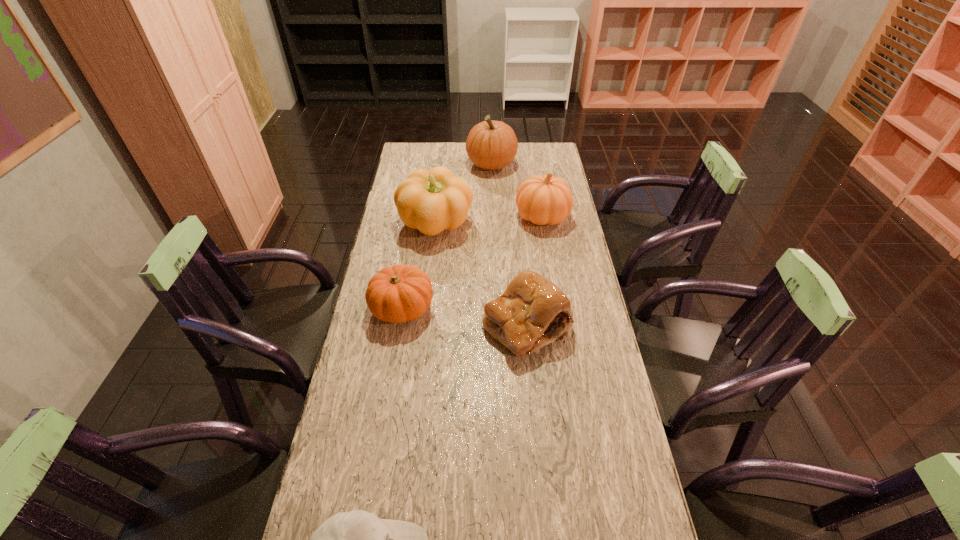
The width and height of the screenshot is (960, 540). What are the coordinates of `the farthest pumpkin` in the screenshot? It's located at (491, 145).

The height and width of the screenshot is (540, 960). In order to click on bread in this screenshot , I will do `click(532, 312)`.

This screenshot has width=960, height=540. What are the coordinates of `the nearest pumpkin` in the screenshot? It's located at (400, 293).

Locate an element on the screen. blank area located on the stem of the farthest pumpkin is located at coordinates (437, 164).

Find the location of a particular element. The image size is (960, 540). vacant area located on the stem of the farthest pumpkin is located at coordinates (451, 164).

At what (x,y) coordinates should I click in order to perform the action: click on free region located on the stem of the farthest pumpkin. Please return your answer as a coordinate pair (x, y). The height and width of the screenshot is (540, 960). Looking at the image, I should click on (449, 164).

Where is `vacant space situated on the filling side of the bread`? vacant space situated on the filling side of the bread is located at coordinates (541, 476).

This screenshot has width=960, height=540. Identify the location of vacant space located 0.290m on the back of the shortest pumpkin. (415, 232).

I want to click on object present at the far edge, so click(491, 145).

Find the location of a particular element. The image size is (960, 540). pumpkin located at the right edge is located at coordinates (545, 199).